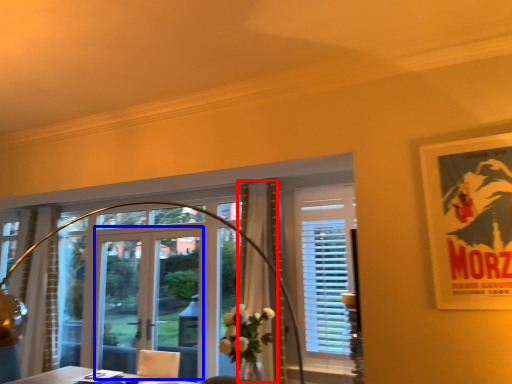
Question: Which point is closer to the camera, curtain (highlighted by a red box) or screen door (highlighted by a blue box)?

Choices:
 (A) curtain
 (B) screen door

Answer: (A)